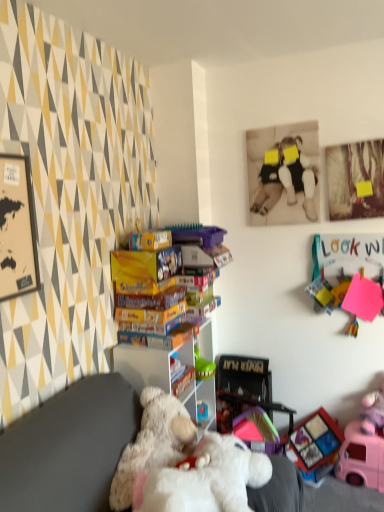
Question: Is white plastic shelf at center in front of sepia-toned photograph at upper center?

Choices:
 (A) yes
 (B) no

Answer: (A)

Question: Is white plastic shelf at center behind sepia-toned photograph at upper center?

Choices:
 (A) yes
 (B) no

Answer: (B)

Question: From the image's perspective, does white plastic shelf at center appear higher than sepia-toned photograph at upper center?

Choices:
 (A) no
 (B) yes

Answer: (A)

Question: Is sepia-toned photograph at upper center at the back of white plastic shelf at center?

Choices:
 (A) no
 (B) yes

Answer: (A)

Question: Does white plastic shelf at center appear on the right side of sepia-toned photograph at upper center?

Choices:
 (A) yes
 (B) no

Answer: (B)

Question: Is white plastic shelf at center in contact with sepia-toned photograph at upper center?

Choices:
 (A) yes
 (B) no

Answer: (B)

Question: Is white plastic shelf at center located within pink plastic toy car at lower right, marked as the fourth toy in a top-to-bottom arrangement?

Choices:
 (A) yes
 (B) no

Answer: (B)

Question: Is pink plastic toy car at lower right, marked as the fourth toy in a top-to-bottom arrangement, positioned with its back to white plastic shelf at center?

Choices:
 (A) no
 (B) yes

Answer: (A)

Question: Is pink plastic toy car at lower right, marked as the fourth toy in a top-to-bottom arrangement, in front of white plastic shelf at center?

Choices:
 (A) yes
 (B) no

Answer: (B)

Question: Is pink plastic toy car at lower right, the first toy ordered from the bottom, not inside white plastic shelf at center?

Choices:
 (A) yes
 (B) no

Answer: (A)

Question: Considering the relative positions of pink plastic toy car at lower right, marked as the fourth toy in a top-to-bottom arrangement, and white plastic shelf at center in the image provided, is pink plastic toy car at lower right, marked as the fourth toy in a top-to-bottom arrangement, to the right of white plastic shelf at center from the viewer's perspective?

Choices:
 (A) no
 (B) yes

Answer: (B)

Question: From the image's perspective, is pink plastic toy car at lower right, the first toy ordered from the bottom, over white plastic shelf at center?

Choices:
 (A) no
 (B) yes

Answer: (A)

Question: Considering the relative sizes of white plastic shelf at center and pink plastic toy car at lower right, the first toy ordered from the bottom, in the image provided, is white plastic shelf at center thinner than pink plastic toy car at lower right, the first toy ordered from the bottom,?

Choices:
 (A) no
 (B) yes

Answer: (A)